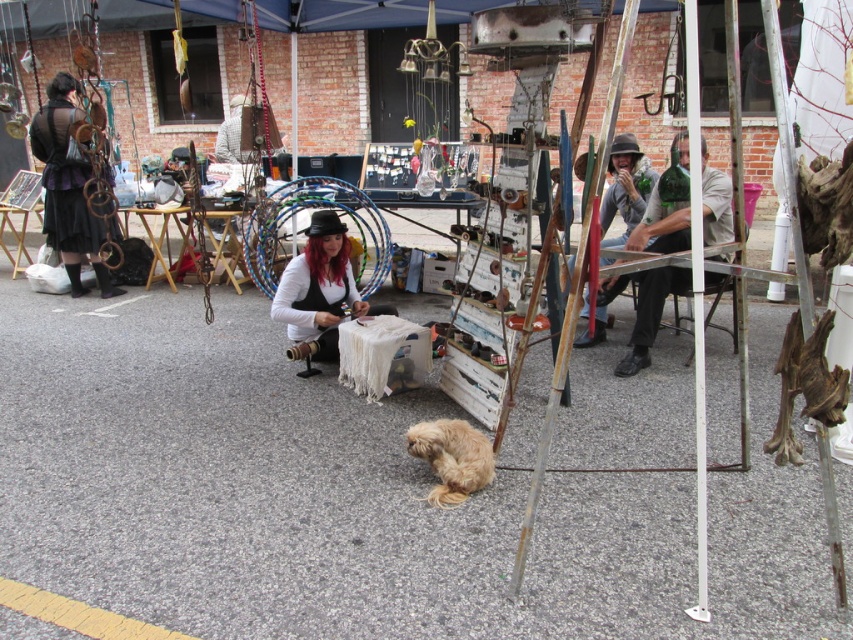
Question: Which point is closer to the camera taking this photo?

Choices:
 (A) (669, 216)
 (B) (67, 180)

Answer: (A)

Question: Among these objects, which one is farthest from the camera?

Choices:
 (A) matte black dress at left
 (B) green glass bottle at center

Answer: (A)

Question: Is green glass bottle at center bigger than white matte fabric at center?

Choices:
 (A) no
 (B) yes

Answer: (B)

Question: Is matte black dress at left below white matte fabric at center?

Choices:
 (A) no
 (B) yes

Answer: (A)

Question: Does white matte fabric at center appear over fuzzy brown dog at center?

Choices:
 (A) yes
 (B) no

Answer: (A)

Question: Which is nearer to the fuzzy brown dog at center?

Choices:
 (A) white matte fabric at center
 (B) matte black dress at left

Answer: (A)